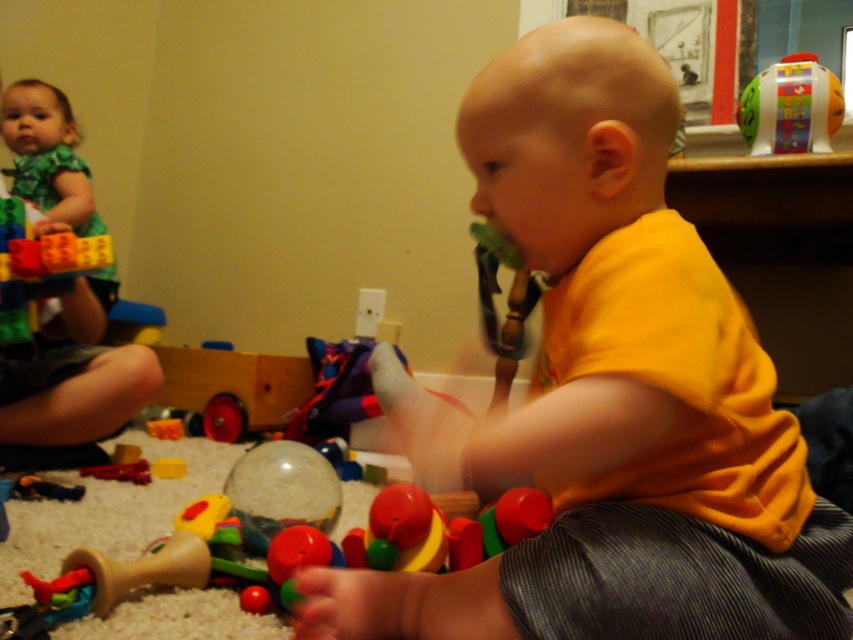
Question: Which of these objects is positioned closest to the yellow matte shirt at center?

Choices:
 (A) translucent plastic ball at center
 (B) green fabric dress at upper left
 (C) wooden toy at center
 (D) plastic abc book at upper right

Answer: (A)

Question: Based on their relative distances, which object is farther from the plastic abc book at upper right?

Choices:
 (A) green fabric dress at upper left
 (B) translucent plastic ball at center
 (C) wooden toy at center
 (D) yellow matte shirt at center

Answer: (A)

Question: Is translucent plastic ball at center above green fabric dress at upper left?

Choices:
 (A) no
 (B) yes

Answer: (A)

Question: Which object is farther from the camera taking this photo?

Choices:
 (A) green fabric dress at upper left
 (B) wooden toy at center
 (C) plastic abc book at upper right
 (D) translucent plastic ball at center

Answer: (A)

Question: Does green fabric dress at upper left appear over wooden toy at center?

Choices:
 (A) yes
 (B) no

Answer: (A)

Question: Is plastic abc book at upper right to the left of wooden toy at center from the viewer's perspective?

Choices:
 (A) yes
 (B) no

Answer: (B)